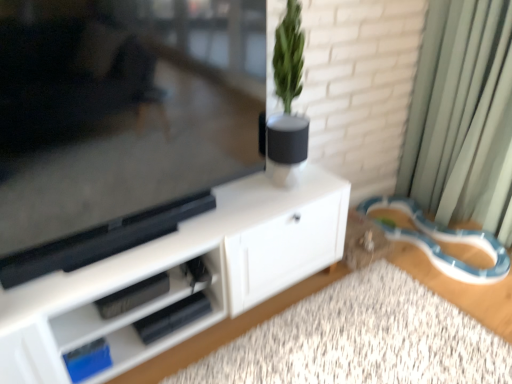
The width and height of the screenshot is (512, 384). Identify the location of blue plastic leash at lower right. (443, 241).

At what (x,y) coordinates should I click in order to perform the action: click on green matte plant at upper center. Please return your answer as a coordinate pair (x, y). Looking at the image, I should click on (287, 103).

The width and height of the screenshot is (512, 384). What do you see at coordinates (178, 275) in the screenshot?
I see `white matte cabinet at center` at bounding box center [178, 275].

This screenshot has width=512, height=384. I want to click on white matte vase at center, so pyautogui.click(x=286, y=148).

What do you see at coordinates (362, 340) in the screenshot? I see `white matte carpet at lower center` at bounding box center [362, 340].

You are a GUI agent. You are given a task and a screenshot of the screen. Output one action in this format:
    pyautogui.click(x=<x>, y=<y>)
    Task: Click on the white matte carpet at lower center
    This screenshot has width=512, height=384.
    Given the screenshot: What is the action you would take?
    pyautogui.click(x=362, y=340)

Find the location of a particular element. blue plastic leash at lower right is located at coordinates (443, 241).

Can you confirm if green fabric curtain at right is bigger than green matte plant at upper center?

Yes, green fabric curtain at right is bigger than green matte plant at upper center.

Does green fabric curtain at right have a lesser height compared to green matte plant at upper center?

No.

Considering the sizes of objects green fabric curtain at right and green matte plant at upper center in the image provided, who is wider, green fabric curtain at right or green matte plant at upper center?

green fabric curtain at right.

Who is more distant, green fabric curtain at right or green matte plant at upper center?

Positioned behind is green matte plant at upper center.

From a real-world perspective, between white matte cabinet at center and white matte carpet at lower center, who is vertically higher?

white matte cabinet at center, from a real-world perspective.

How far apart are white matte cabinet at center and white matte carpet at lower center?

white matte cabinet at center is 36.02 centimeters from white matte carpet at lower center.

Is white matte cabinet at center beside white matte carpet at lower center?

No, white matte cabinet at center is not with white matte carpet at lower center.

Does white matte cabinet at center lie behind white matte carpet at lower center?

Yes, white matte cabinet at center is further from the camera.

Where is `leash behind the white matte cabinet at center`? leash behind the white matte cabinet at center is located at coordinates (443, 241).

Considering the relative sizes of white matte cabinet at center and blue plastic leash at lower right in the image provided, is white matte cabinet at center wider than blue plastic leash at lower right?

Incorrect, the width of white matte cabinet at center does not surpass that of blue plastic leash at lower right.

Can you see white matte cabinet at center touching blue plastic leash at lower right?

They are not placed beside each other.

Which object is positioned more to the right, white matte cabinet at center or blue plastic leash at lower right?

blue plastic leash at lower right.

Is green fabric curtain at right located outside white matte carpet at lower center?

Yes, green fabric curtain at right is located beyond the bounds of white matte carpet at lower center.

Locate an element on the screen. The image size is (512, 384). plain in front of the green fabric curtain at right is located at coordinates (362, 340).

Could you tell me if green fabric curtain at right is turned towards white matte carpet at lower center?

Yes, green fabric curtain at right faces towards white matte carpet at lower center.

From the image's perspective, is green fabric curtain at right on white matte carpet at lower center?

Yes.

Measure the distance between green matte plant at upper center and white matte vase at center.

green matte plant at upper center and white matte vase at center are 2.42 inches apart.

Is green matte plant at upper center looking in the opposite direction of white matte vase at center?

No, green matte plant at upper center's orientation is not away from white matte vase at center.

Are green matte plant at upper center and white matte vase at center far apart?

No, there isn't a large distance between green matte plant at upper center and white matte vase at center.

Considering the positions of point (292, 14) and point (302, 146), is point (292, 14) closer or farther from the camera than point (302, 146)?

Point (292, 14).

Are white matte cabinet at center and white matte vase at center making contact?

No, white matte cabinet at center is not beside white matte vase at center.

From the image's perspective, which is above, white matte cabinet at center or white matte vase at center?

white matte vase at center.

Does white matte cabinet at center have a lesser width compared to white matte vase at center?

No.

From a real-world perspective, is white matte cabinet at center located beneath white matte vase at center?

Indeed, from a real-world perspective, white matte cabinet at center is positioned beneath white matte vase at center.

Looking at their sizes, would you say white matte cabinet at center is wider or thinner than green matte plant at upper center?

In the image, white matte cabinet at center appears to be wider than green matte plant at upper center.

From the image's perspective, is white matte cabinet at center located above or below green matte plant at upper center?

Based on their image positions, white matte cabinet at center is located beneath green matte plant at upper center.

Which is more to the left, white matte cabinet at center or green matte plant at upper center?

white matte cabinet at center.

Is white matte cabinet at center beside green matte plant at upper center?

white matte cabinet at center is not next to green matte plant at upper center, and they're not touching.

Where is `curtain that appears on the right of green matte plant at upper center`? curtain that appears on the right of green matte plant at upper center is located at coordinates (463, 116).

Locate an element on the screen. The image size is (512, 384). plain located underneath the white matte cabinet at center (from a real-world perspective) is located at coordinates pyautogui.click(x=362, y=340).

Which object lies further to the anchor point white matte cabinet at center, white matte vase at center or green matte plant at upper center?

Based on the image, green matte plant at upper center appears to be further to white matte cabinet at center.

From the image, which object appears to be nearer to blue plastic leash at lower right, white matte cabinet at center or green fabric curtain at right?

Among the two, green fabric curtain at right is located nearer to blue plastic leash at lower right.

Based on their spatial positions, is green matte plant at upper center or green fabric curtain at right closer to white matte cabinet at center?

green matte plant at upper center is positioned closer to the anchor white matte cabinet at center.

Considering their positions, is white matte cabinet at center positioned closer to green matte plant at upper center than white matte vase at center?

Among the two, white matte vase at center is located nearer to green matte plant at upper center.

Estimate the real-world distances between objects in this image. Which object is further from green matte plant at upper center, white matte vase at center or white matte carpet at lower center?

The object further to green matte plant at upper center is white matte carpet at lower center.

Considering their positions, is blue plastic leash at lower right positioned closer to white matte cabinet at center than green fabric curtain at right?

blue plastic leash at lower right lies closer to white matte cabinet at center than the other object.

Based on their spatial positions, is green matte plant at upper center or white matte cabinet at center closer to green fabric curtain at right?

Based on the image, green matte plant at upper center appears to be nearer to green fabric curtain at right.

Estimate the real-world distances between objects in this image. Which object is further from blue plastic leash at lower right, white matte vase at center or green fabric curtain at right?

white matte vase at center is further to blue plastic leash at lower right.

This screenshot has width=512, height=384. Identify the location of plain situated between white matte cabinet at center and green fabric curtain at right from left to right. (362, 340).

Find the location of a particular element. vase between green matte plant at upper center and white matte carpet at lower center in the up-down direction is located at coordinates (286, 148).

Locate an element on the screen. The image size is (512, 384). leash between green matte plant at upper center and white matte carpet at lower center vertically is located at coordinates (443, 241).

Find the location of a particular element. The width and height of the screenshot is (512, 384). cabinetry between green matte plant at upper center and white matte carpet at lower center in the up-down direction is located at coordinates (178, 275).